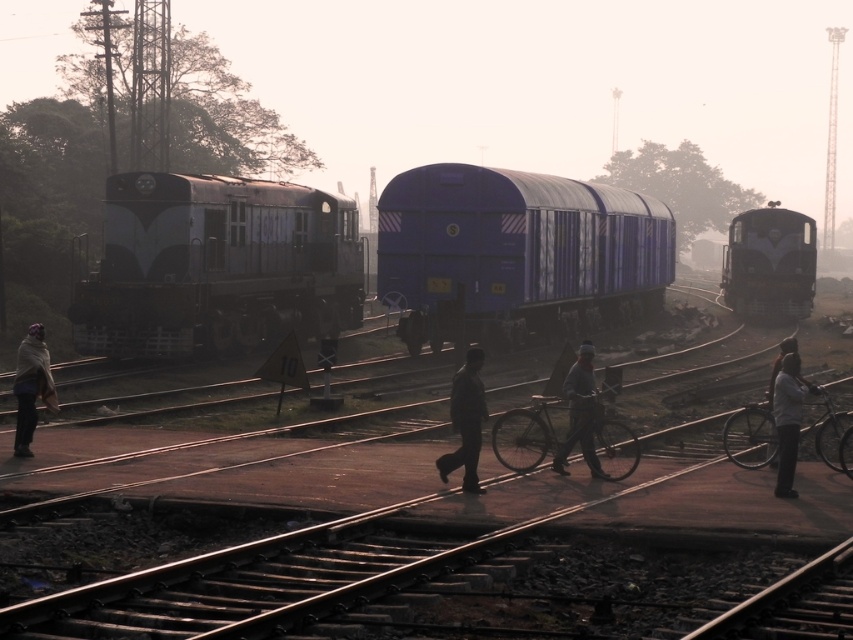
Question: Based on their relative distances, which object is farther from the light gray fabric jacket at lower right?

Choices:
 (A) matte black train at left
 (B) matte black train at right
 (C) dark gray suit at center
 (D) blue matte freight car at center

Answer: (B)

Question: Does matte black train at left have a larger size compared to matte black train at right?

Choices:
 (A) no
 (B) yes

Answer: (B)

Question: From the image, what is the correct spatial relationship of matte black train at left in relation to gray knit cap at center?

Choices:
 (A) left
 (B) right

Answer: (A)

Question: Which of the following is the closest to the observer?

Choices:
 (A) dark gray suit at center
 (B) light gray fabric jacket at lower right
 (C) matte black train at left
 (D) matte black train at right

Answer: (B)

Question: Can you confirm if matte black train at left is positioned to the right of light gray fabric jacket at lower right?

Choices:
 (A) no
 (B) yes

Answer: (A)

Question: Which object is closer to the camera taking this photo?

Choices:
 (A) light gray fabric jacket at lower right
 (B) gray knit cap at center
 (C) matte black train at left

Answer: (A)